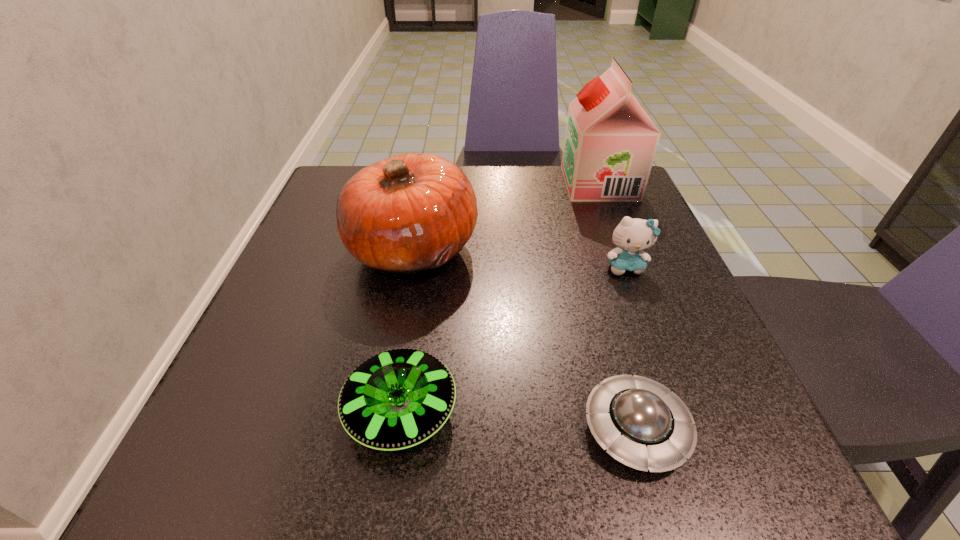
Identify the location of free space between the kitten and the farthest object. (612, 225).

Image resolution: width=960 pixels, height=540 pixels. I want to click on free point between the second tallest object and the right saucer, so click(525, 339).

Find the location of `unoccupied area between the shorter saucer and the farthest object`. unoccupied area between the shorter saucer and the farthest object is located at coordinates (617, 306).

Locate an element on the screen. The height and width of the screenshot is (540, 960). free space between the taller saucer and the kitten is located at coordinates (514, 339).

Where is `blank region between the tallest object and the left saucer`? Image resolution: width=960 pixels, height=540 pixels. blank region between the tallest object and the left saucer is located at coordinates (500, 297).

Locate an element on the screen. This screenshot has height=540, width=960. free space between the right saucer and the left saucer is located at coordinates (518, 420).

At what (x,y) coordinates should I click in order to perform the action: click on free space that is in between the fourth tallest object and the shortest object. Please return your answer as a coordinate pair (x, y). Image resolution: width=960 pixels, height=540 pixels. Looking at the image, I should click on (518, 420).

Image resolution: width=960 pixels, height=540 pixels. Find the location of `vacant point located between the fourth shortest object and the third tallest object`. vacant point located between the fourth shortest object and the third tallest object is located at coordinates click(519, 258).

In order to click on free point between the fourth shortest object and the kitten in this screenshot , I will do click(519, 258).

Identify which object is located as the third nearest to the tallest object. Please provide its 2D coordinates. Your answer should be formatted as a tuple, i.e. [(x, y)], where the tuple contains the x and y coordinates of a point satisfying the conditions above.

[(640, 423)]